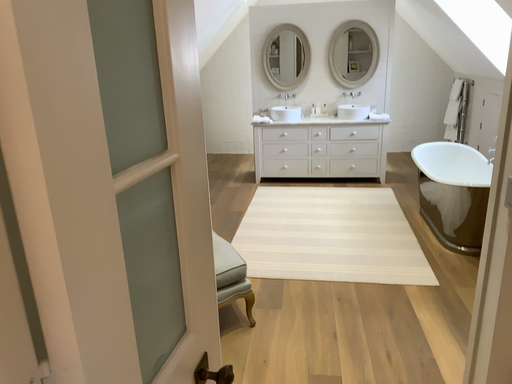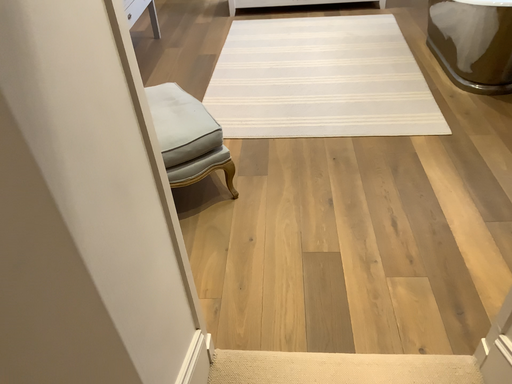
Question: How did the camera likely rotate when shooting the video?

Choices:
 (A) rotated downward
 (B) rotated upward

Answer: (A)